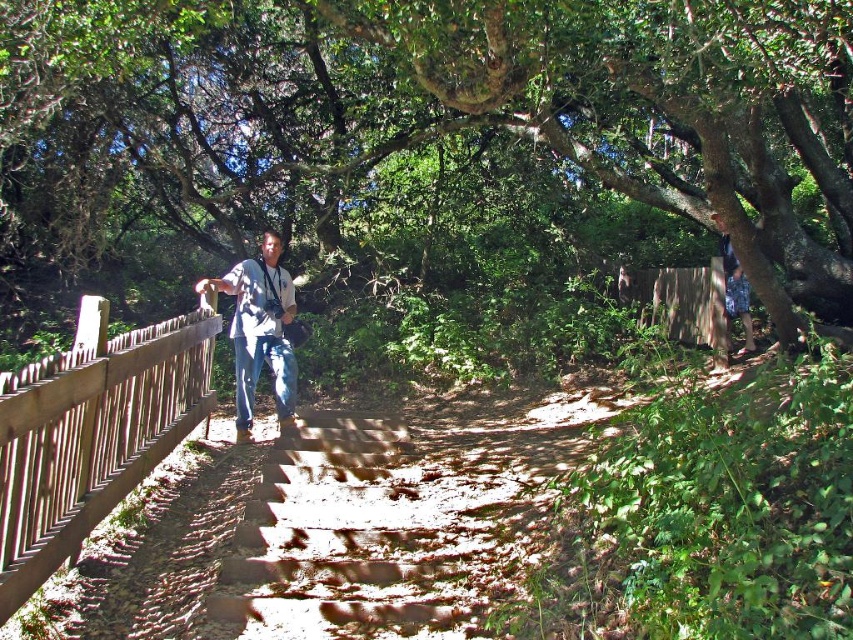
Where is `green leafy tree at upper center`? Image resolution: width=853 pixels, height=640 pixels. green leafy tree at upper center is located at coordinates (418, 116).

Is green leafy tree at upper center closer to camera compared to blue jeans at center?

Yes, it is.

Identify the location of green leafy tree at upper center. Image resolution: width=853 pixels, height=640 pixels. (418, 116).

Can you confirm if matte gray shirt at center is positioned to the right of blue jeans at center?

Incorrect, matte gray shirt at center is not on the right side of blue jeans at center.

Between point (239, 385) and point (270, 365), which one is positioned in front?

Point (239, 385) is in front.

Find the location of a particular element. The width and height of the screenshot is (853, 640). matte gray shirt at center is located at coordinates (260, 330).

Is the position of brown wooden fence at left less distant than that of blue jeans at center?

That is True.

Does brown wooden fence at left have a larger size compared to blue jeans at center?

Indeed, brown wooden fence at left has a larger size compared to blue jeans at center.

What do you see at coordinates (91, 436) in the screenshot? The height and width of the screenshot is (640, 853). I see `brown wooden fence at left` at bounding box center [91, 436].

At what (x,y) coordinates should I click in order to perform the action: click on brown wooden fence at left. Please return your answer as a coordinate pair (x, y). Image resolution: width=853 pixels, height=640 pixels. Looking at the image, I should click on (x=91, y=436).